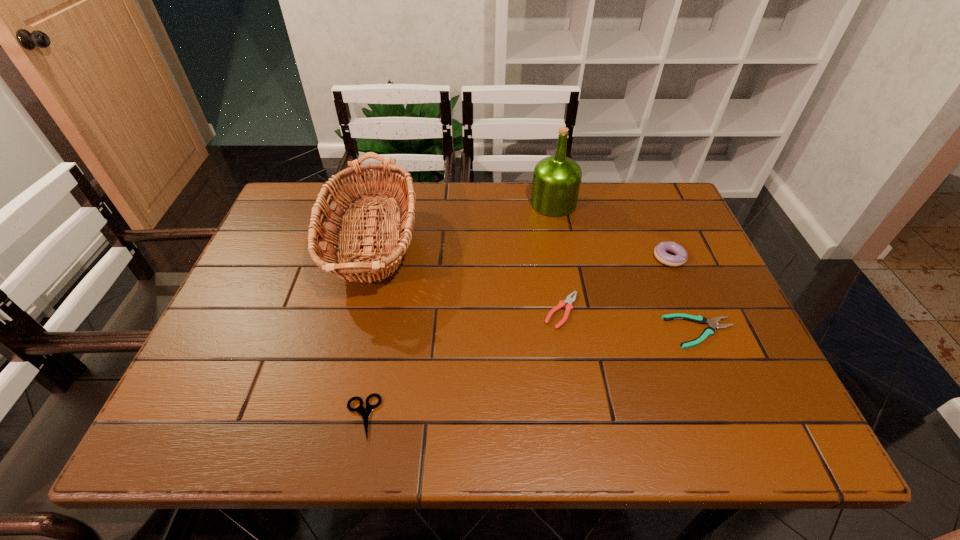
The image size is (960, 540). In order to click on the tallest object in this screenshot , I will do `click(556, 179)`.

Image resolution: width=960 pixels, height=540 pixels. Find the location of `the fifth shortest object`. the fifth shortest object is located at coordinates (348, 262).

I want to click on the fourth shortest object, so click(x=660, y=251).

I want to click on the left pliers, so click(569, 300).

The image size is (960, 540). I want to click on the shorter pliers, so click(x=712, y=323).

Locate an element on the screen. the nearest object is located at coordinates (364, 412).

The width and height of the screenshot is (960, 540). What are the coordinates of `vacant region located on the right of the olive oil` in the screenshot? It's located at (670, 204).

This screenshot has height=540, width=960. I want to click on free space located 0.160m on the front of the basket, so click(x=339, y=385).

Locate an element on the screen. free region located on the left of the fourth shortest object is located at coordinates (527, 258).

Where is `vacant space located on the back of the left pliers`? This screenshot has width=960, height=540. vacant space located on the back of the left pliers is located at coordinates (542, 195).